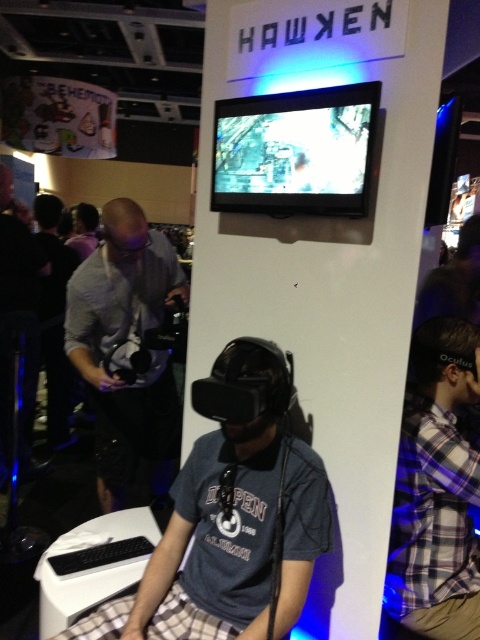
Question: Which object is closer to the camera taking this photo?

Choices:
 (A) plaid fabric shirt at right
 (B) gray fabric shirt at left

Answer: (A)

Question: Observing the image, what is the correct spatial positioning of matte gray vr headset at center in reference to plaid fabric shirt at right?

Choices:
 (A) above
 (B) below

Answer: (B)

Question: Can you confirm if plaid fabric shirt at right is bigger than gray fabric shirt at left?

Choices:
 (A) yes
 (B) no

Answer: (B)

Question: Is plaid fabric shirt at right positioned at the back of gray fabric shirt at left?

Choices:
 (A) yes
 (B) no

Answer: (B)

Question: Among these objects, which one is nearest to the camera?

Choices:
 (A) plaid fabric shirt at right
 (B) gray fabric shirt at left
 (C) matte gray vr headset at center

Answer: (C)

Question: Which point is closer to the camera?

Choices:
 (A) gray fabric shirt at left
 (B) matte gray vr headset at center
 (C) plaid fabric shirt at right

Answer: (B)